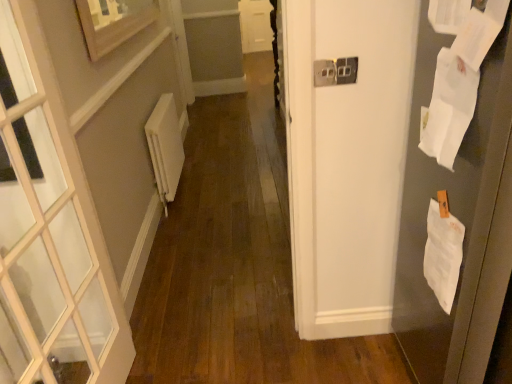
The height and width of the screenshot is (384, 512). I want to click on vacant space to the right of white matte radiator at left, so click(216, 190).